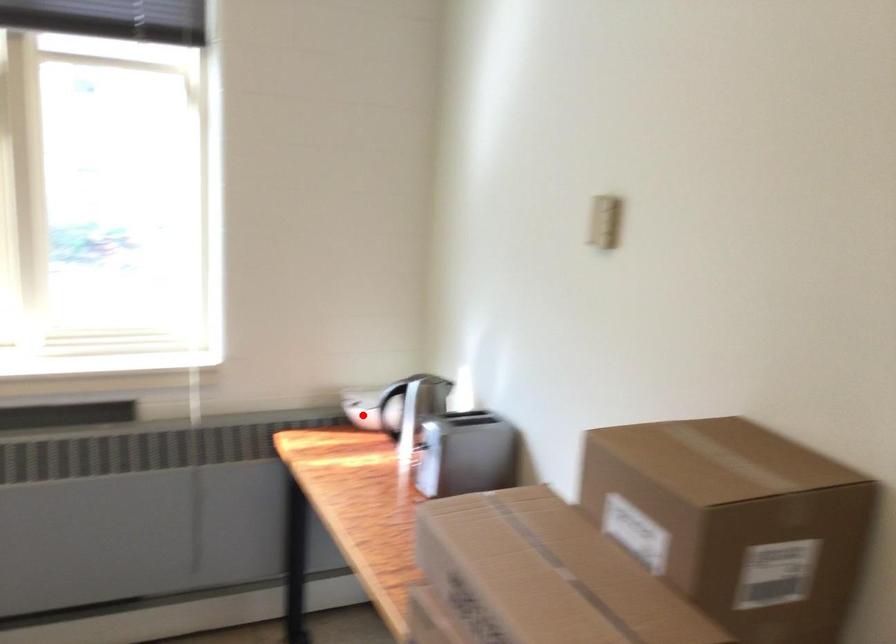
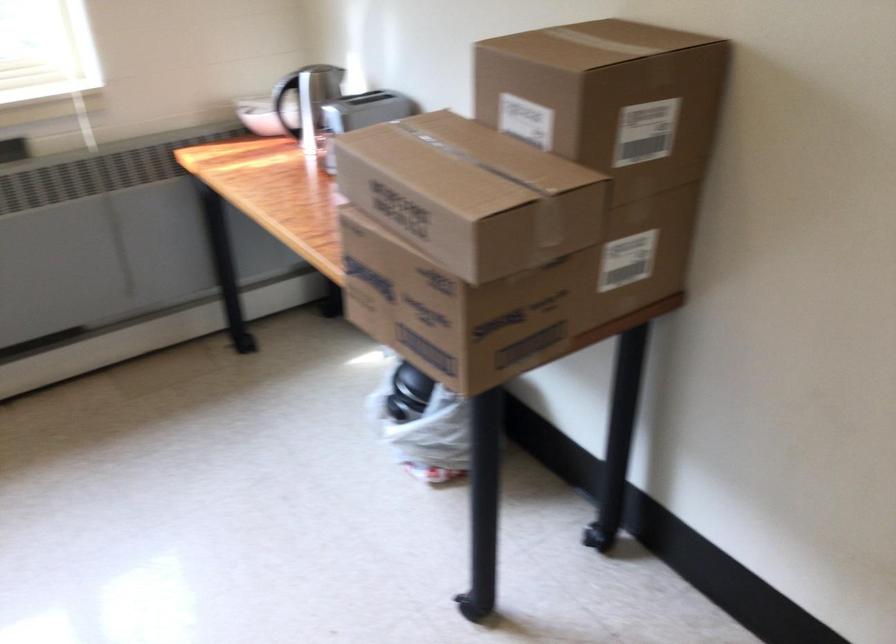
Where in the second image is the point corresponding to the highlighted location from the first image?

(257, 115)